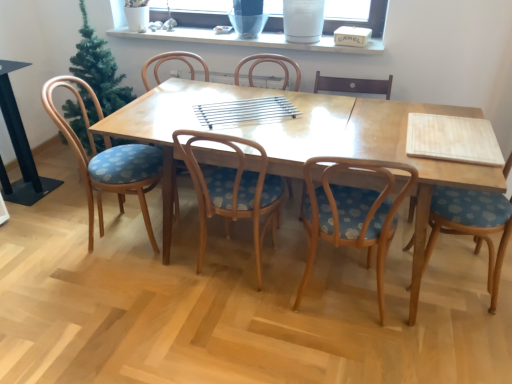
The width and height of the screenshot is (512, 384). What are the coordinates of `vacant area that lies between blue fabric chair at right, the 6th chair in the left-to-right sequence, and wooden chair with blue floral cushion at center, acting as the 5th chair starting from the left` in the screenshot? It's located at (x=428, y=313).